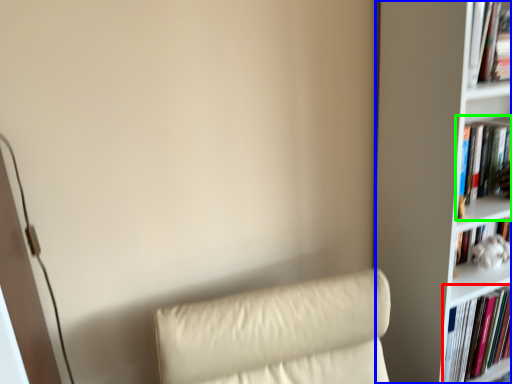
Question: Based on their relative distances, which object is nearer to book (highlighted by a red box)? Choose from bookcase (highlighted by a blue box) and book (highlighted by a green box).

Choices:
 (A) bookcase
 (B) book

Answer: (A)